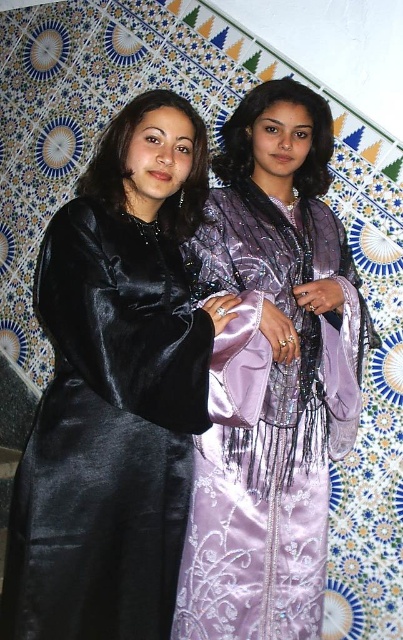
Question: Among these points, which one is nearest to the camera?

Choices:
 (A) [292, 417]
 (B) [180, 186]

Answer: (A)

Question: Which point appears closest to the camera in this image?

Choices:
 (A) (199, 129)
 (B) (218, 244)

Answer: (A)

Question: Can you confirm if matte black dress at left is thinner than lavender satin dress at center?

Choices:
 (A) no
 (B) yes

Answer: (A)

Question: Is matte black dress at left smaller than lavender satin dress at center?

Choices:
 (A) yes
 (B) no

Answer: (B)

Question: Does matte black dress at left have a larger size compared to lavender satin dress at center?

Choices:
 (A) yes
 (B) no

Answer: (A)

Question: Which point is farther to the camera?

Choices:
 (A) lavender satin dress at center
 (B) matte black dress at left

Answer: (A)